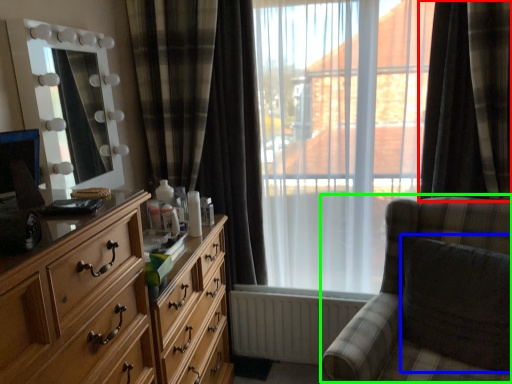
Question: Based on their relative distances, which object is farther from curtain (highlighted by a red box)? Choose from swivel chair (highlighted by a blue box) and rocking chair (highlighted by a green box).

Choices:
 (A) swivel chair
 (B) rocking chair

Answer: (A)